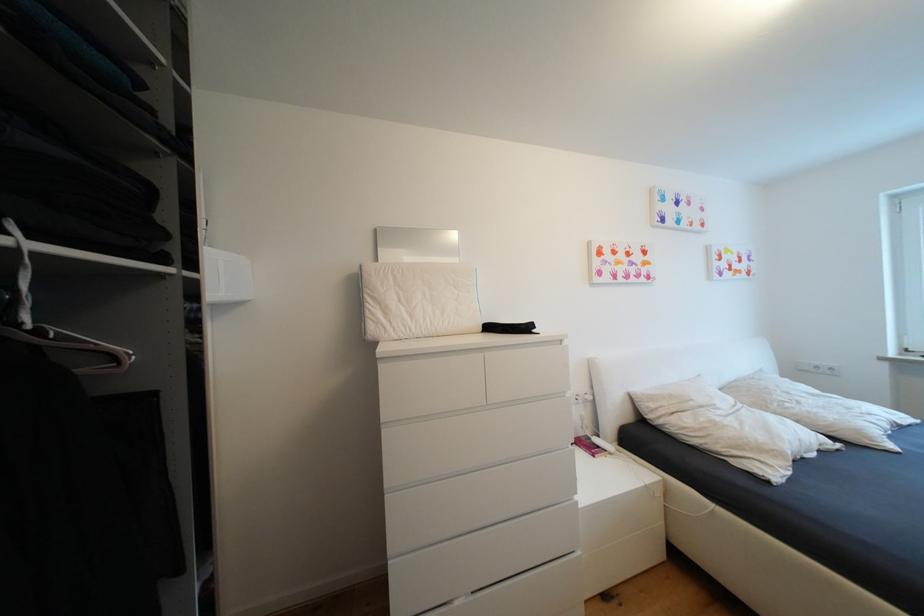
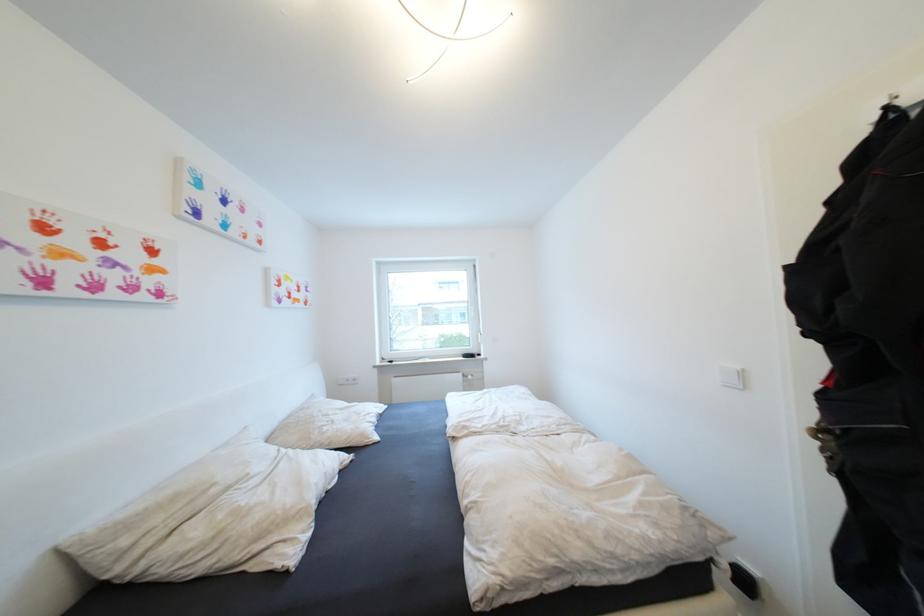
Question: The camera is either moving clockwise (left) or counter-clockwise (right) around the object. The first image is from the beginning of the video and the second image is from the end. Is the camera moving left or right when shooting the video?

Choices:
 (A) Left
 (B) Right

Answer: (A)